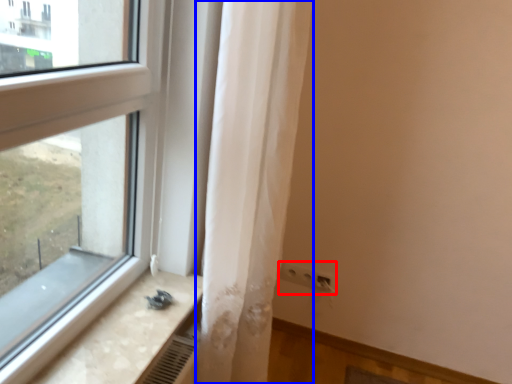
Question: Which object is closer to the camera taking this photo, electric outlet (highlighted by a red box) or curtain (highlighted by a blue box)?

Choices:
 (A) electric outlet
 (B) curtain

Answer: (B)